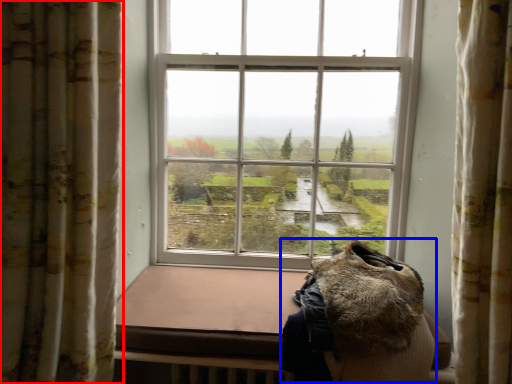
Question: Among these objects, which one is farthest to the camera, curtain (highlighted by a red box) or animal (highlighted by a blue box)?

Choices:
 (A) curtain
 (B) animal

Answer: (B)